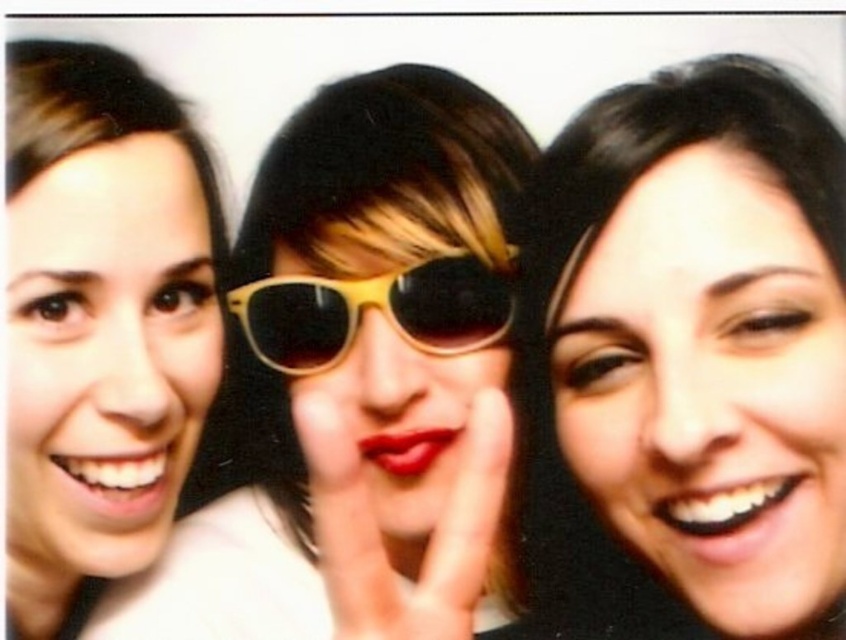
Who is more forward, (833, 212) or (268, 356)?

Point (833, 212)

Is point (665, 282) positioned behind point (482, 285)?

That is False.

Between point (600, 556) and point (405, 289), which one is positioned in front?

Point (600, 556)

Find the location of a particular element. Image resolution: width=846 pixels, height=640 pixels. smooth skin face at center is located at coordinates pos(701,332).

Measure the distance between smooth skin face at center and matte white face at left.

smooth skin face at center and matte white face at left are 36.66 centimeters apart from each other.

Measure the distance from smooth skin face at center to matte white face at left.

smooth skin face at center and matte white face at left are 14.43 inches apart from each other.

The width and height of the screenshot is (846, 640). I want to click on smooth skin face at center, so click(701, 332).

Find the location of a particular element. The width and height of the screenshot is (846, 640). smooth skin face at center is located at coordinates (701, 332).

Is matte white face at left in front of yellow plastic sunglasses at center?

Yes, it is in front of yellow plastic sunglasses at center.

Measure the distance from matte white face at left to yellow plastic sunglasses at center.

The distance of matte white face at left from yellow plastic sunglasses at center is 6.15 inches.

Who is more forward, (188, 246) or (479, 275)?

Point (188, 246)

Identify the location of matte white face at left. Image resolution: width=846 pixels, height=640 pixels. (100, 321).